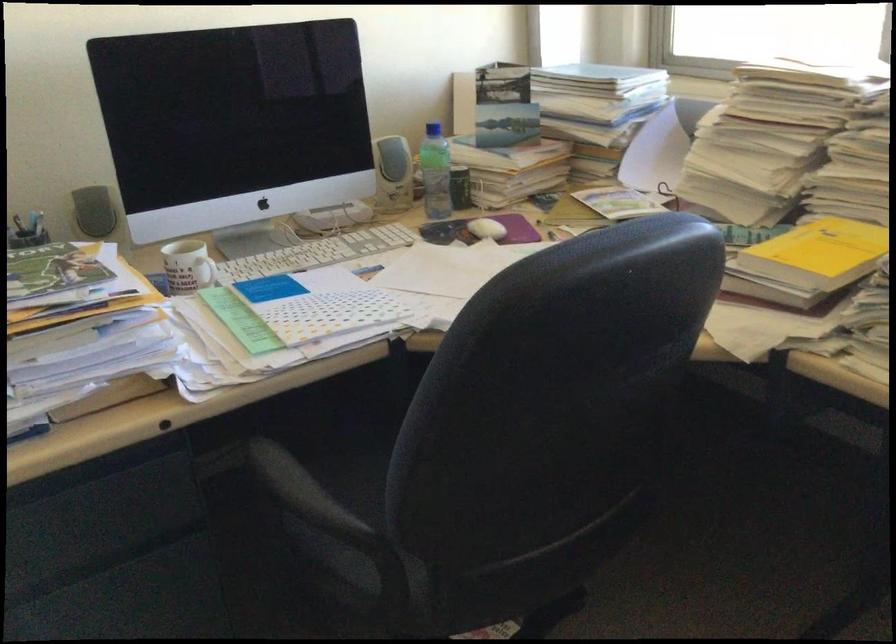
Where would you lift the white mug handle? Please return your answer as a coordinate pair (x, y).

(204, 272)